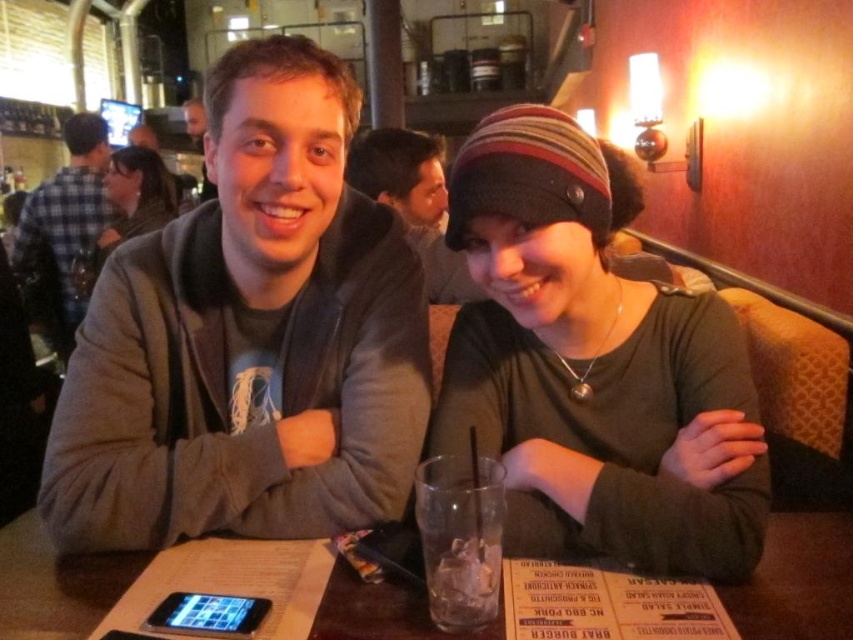
You are a photographer adjusting the focus of your camera. The camera is currently focused on the person on the left. To adjust focus to the matte black beanie at upper center, should you move the focus point to the left or right? Please provide your answer based on the coordinates provided in the scene description.

The matte black beanie at upper center is located at coordinates point (135, 196). Since the camera is currently focused on the person on the left, you should move the focus point to the right to align with the matte black beanie at upper center.

You are a photographer adjusting your camera settings to capture the scene. You notice the matte black beanie at upper center and the matte gray hoodie at center. Which object should you focus on first if you want to ensure both are in sharp focus, considering their positions?

The matte black beanie at upper center is positioned under the matte gray hoodie at center. To ensure both are in sharp focus, you should focus on the matte gray hoodie at center first since it is closer to the camera, and the beanie will naturally fall into focus due to its proximity.